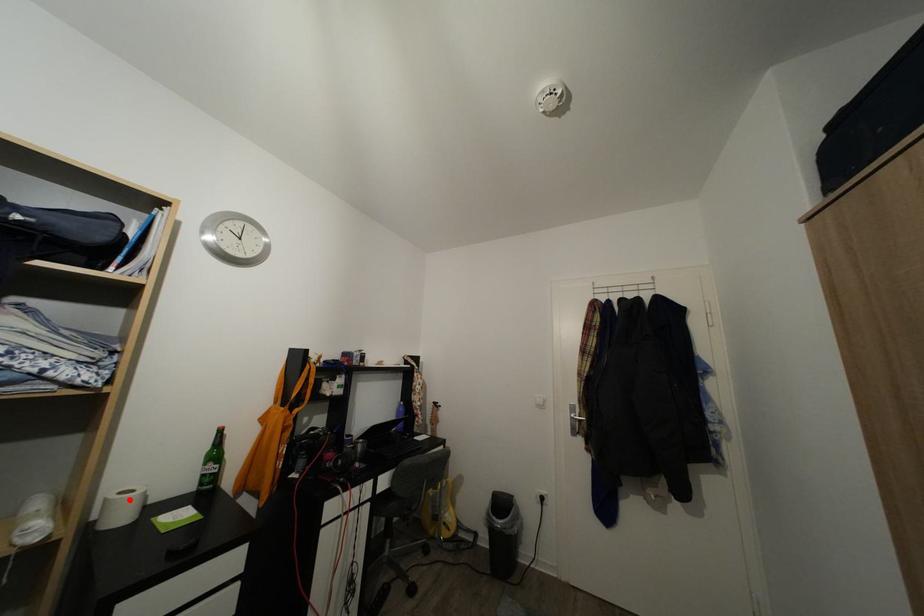
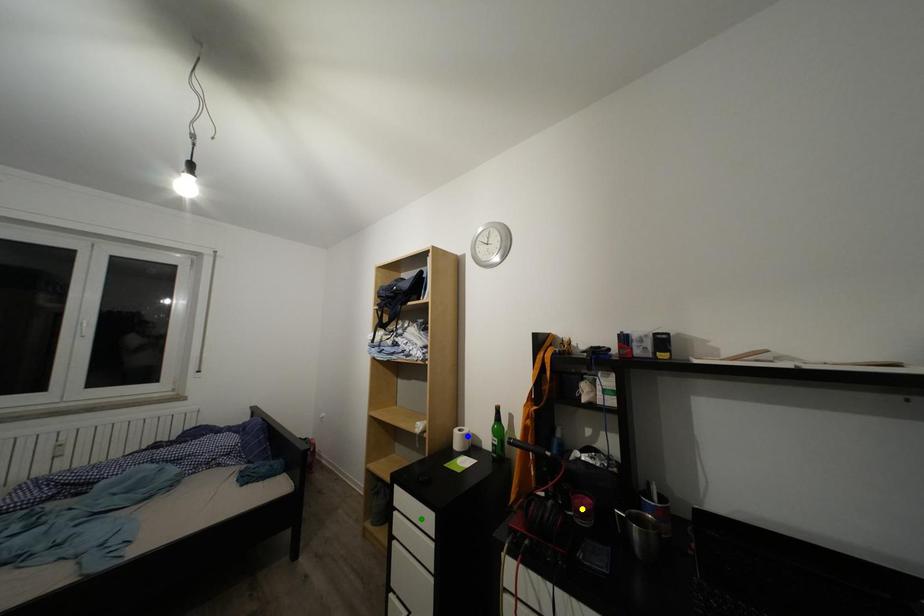
Question: I am providing you with two images of the same scene from different viewpoints. A red point is marked on the first image. You are given multiple points on the second image. Which spot in image 2 lines up with the point in image 1?

Choices:
 (A) blue point
 (B) green point
 (C) yellow point

Answer: (A)